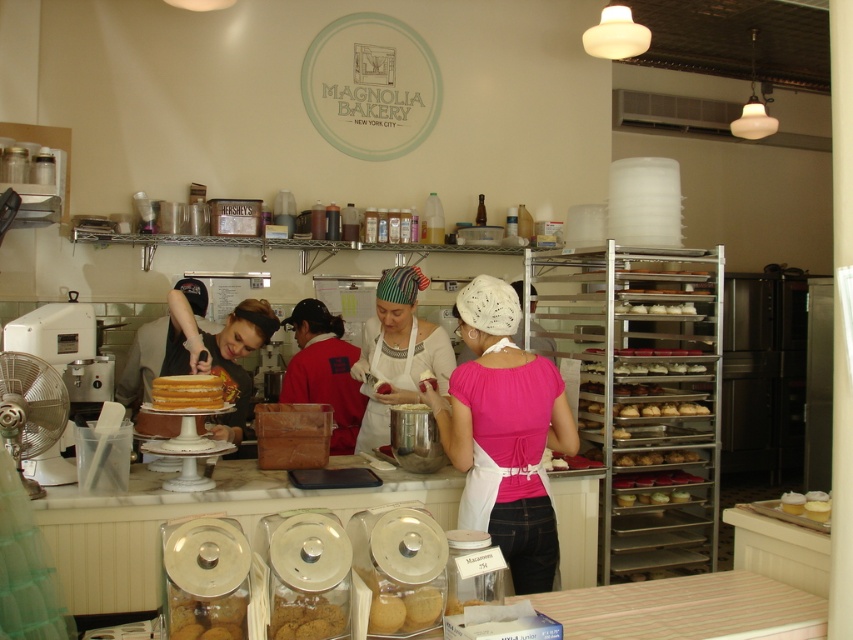
Question: Which object appears closest to the camera in this image?

Choices:
 (A) striped fabric headscarf at center
 (B) yellow sponge cake at center
 (C) red fabric apron at center

Answer: (B)

Question: Is pink satin blouse at center to the left of white matte cupcake at center from the viewer's perspective?

Choices:
 (A) no
 (B) yes

Answer: (B)

Question: Which point is farther from the camera taking this photo?

Choices:
 (A) (567, 413)
 (B) (352, 417)

Answer: (B)

Question: Which object is positioned farthest from the matte black cake at center?

Choices:
 (A) yellow sponge cake at center
 (B) pink satin blouse at center
 (C) striped fabric headscarf at center

Answer: (B)

Question: Is pink satin blouse at center closer to camera compared to matte black cake at center?

Choices:
 (A) yes
 (B) no

Answer: (A)

Question: Can you confirm if red fabric apron at center is positioned below white matte cupcake at center?

Choices:
 (A) no
 (B) yes

Answer: (A)